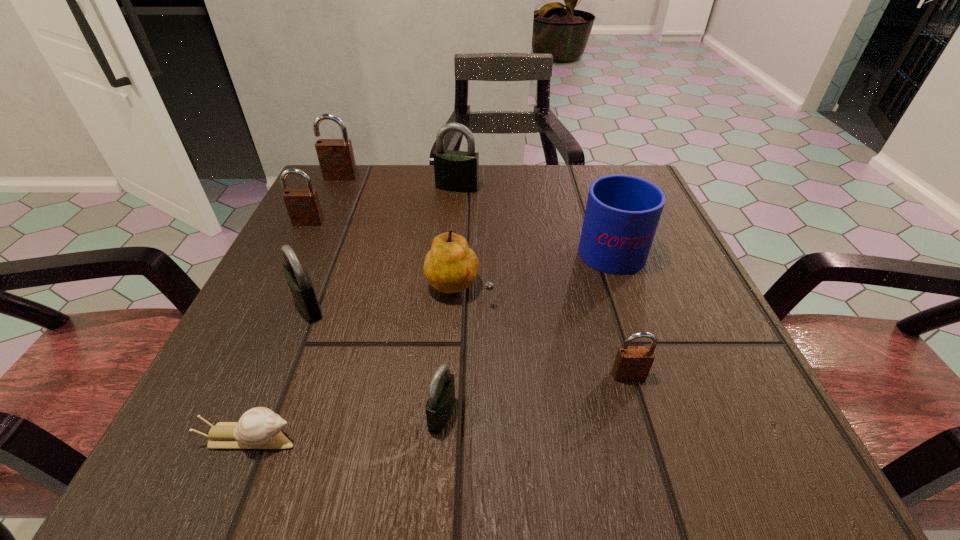
Where is `vacant area that lies between the nearest black padlock and the shortest object`? vacant area that lies between the nearest black padlock and the shortest object is located at coordinates (347, 426).

This screenshot has width=960, height=540. I want to click on free space that is in between the farthest black padlock and the shortest object, so click(x=353, y=313).

Locate an element on the screen. The image size is (960, 540). vacant point located between the blue mug and the pear is located at coordinates (534, 266).

Where is `free spot between the second farthest object and the shortest object`? free spot between the second farthest object and the shortest object is located at coordinates (353, 313).

This screenshot has width=960, height=540. What are the coordinates of `vacant area that lies between the escargot and the smallest black padlock` in the screenshot? It's located at (347, 426).

Locate an element on the screen. empty space that is in between the second biggest brown padlock and the rightmost padlock is located at coordinates (468, 299).

Where is `free point between the mug and the biggest brown padlock`? The width and height of the screenshot is (960, 540). free point between the mug and the biggest brown padlock is located at coordinates (x=475, y=211).

At what (x,y) coordinates should I click in order to perform the action: click on vacant area that lies between the biggest black padlock and the shortest object. Please return your answer as a coordinate pair (x, y). Looking at the image, I should click on (353, 313).

Select which object is the second closest to the pear. Please provide its 2D coordinates. Your answer should be formatted as a tuple, i.e. [(x, y)], where the tuple contains the x and y coordinates of a point satisfying the conditions above.

[(441, 396)]

In order to click on the eighth closest object to the nearest padlock in this screenshot , I will do `click(336, 157)`.